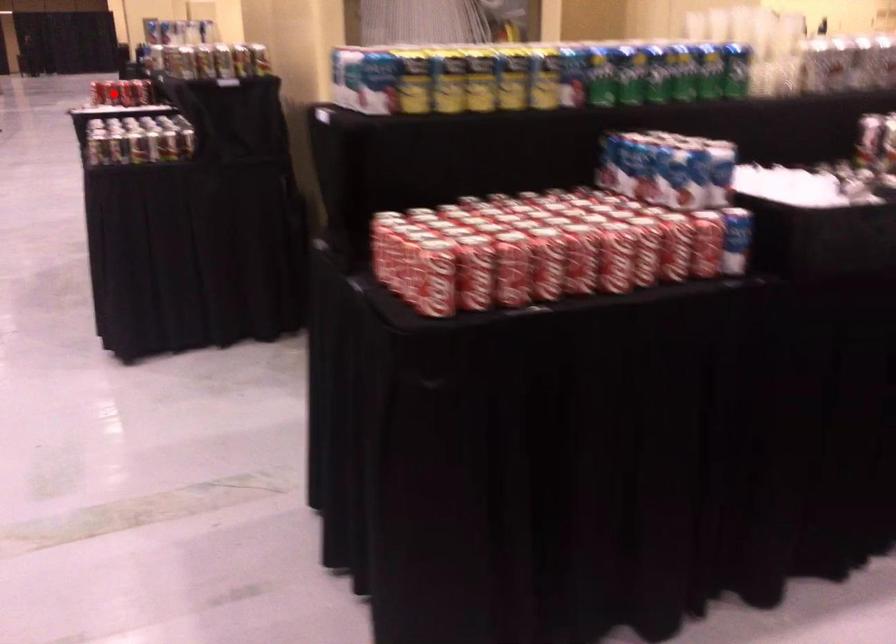
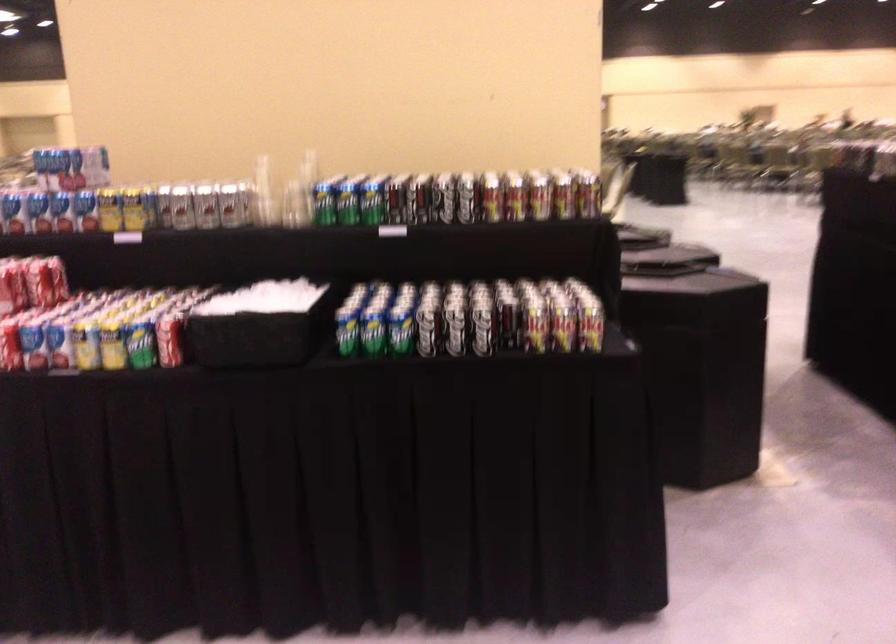
The point at the highlighted location is marked in the first image. Where is the corresponding point in the second image?

(112, 346)